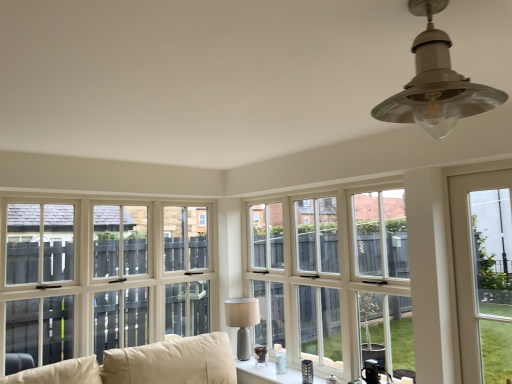
Find the location of `free space above satin silver lampshade at upper center, the second lamp in the bottom-to-top sequence (from a real-world perspective)`. free space above satin silver lampshade at upper center, the second lamp in the bottom-to-top sequence (from a real-world perspective) is located at coordinates (406, 13).